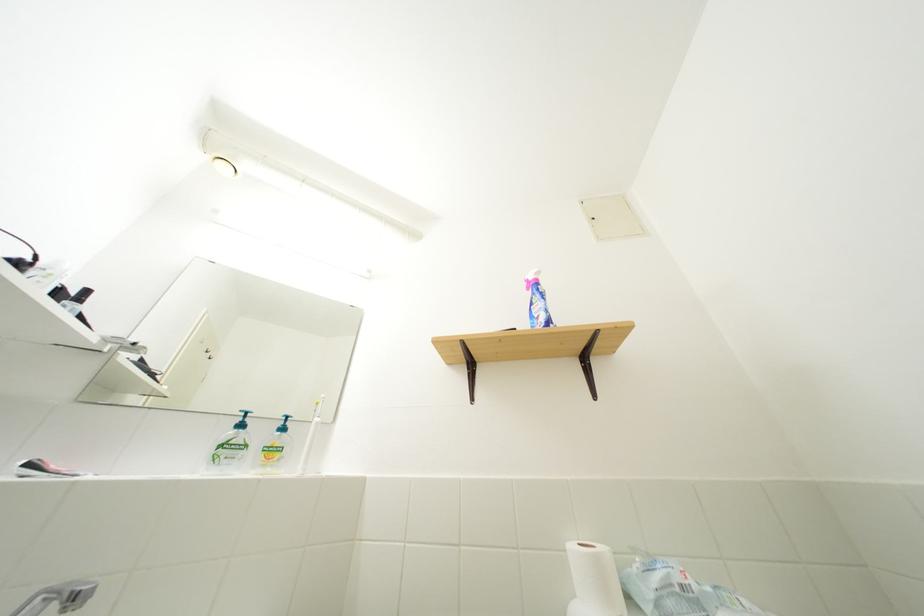
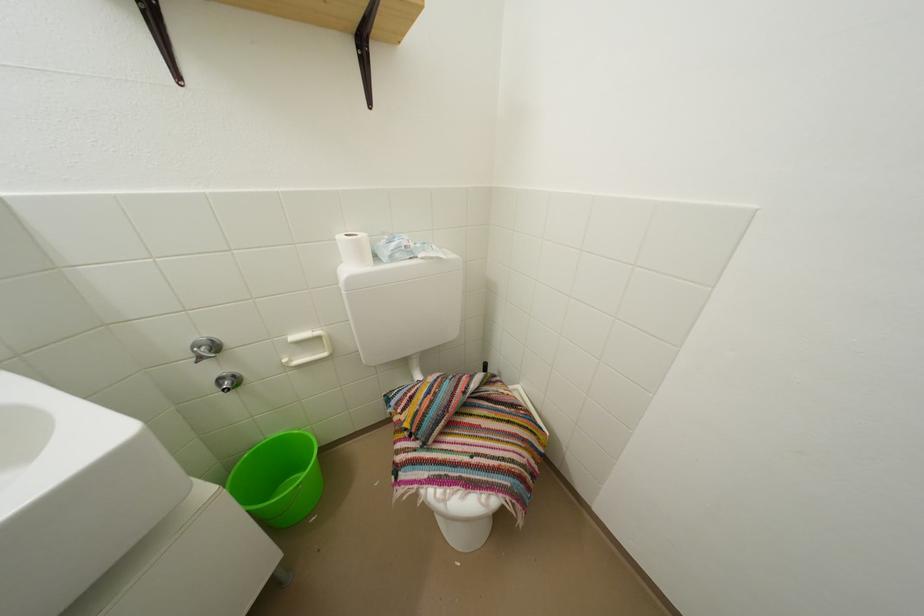
Based on the continuous images, in which direction is the camera rotating?

The camera's rotation is toward right-down.